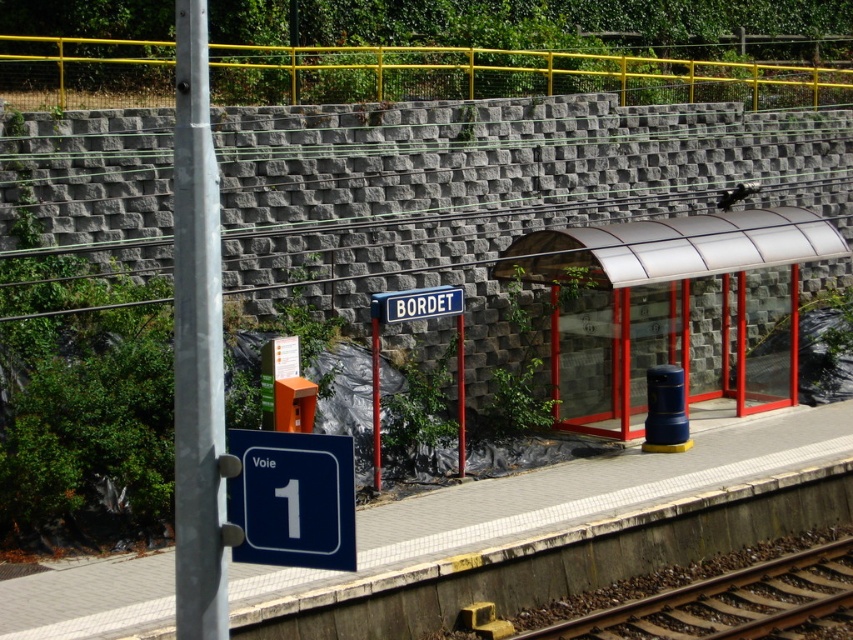
Question: Which point appears farthest from the camera in this image?

Choices:
 (A) [323, 513]
 (B) [711, 77]
 (C) [653, 616]

Answer: (B)

Question: Estimate the real-world distances between objects in this image. Which object is farther from the brown gravel train track at lower right?

Choices:
 (A) metallic gray pole at left
 (B) yellow metal railing at upper center

Answer: (B)

Question: Is the position of metallic gray pole at left less distant than that of blue plastic sign at lower left?

Choices:
 (A) yes
 (B) no

Answer: (A)

Question: Considering the real-world distances, which object is closest to the transparent plastic bus stop at center?

Choices:
 (A) blue plastic sign at lower left
 (B) smooth concrete platform at center

Answer: (B)

Question: Can you confirm if smooth concrete platform at center is positioned to the right of blue metallic sign at center?

Choices:
 (A) yes
 (B) no

Answer: (A)

Question: Is transparent plastic bus stop at center in front of blue metallic sign at center?

Choices:
 (A) yes
 (B) no

Answer: (B)